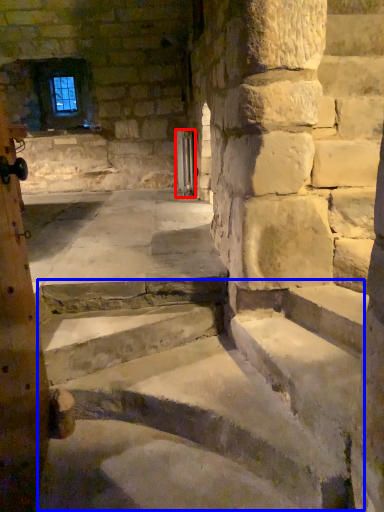
Question: Which of the following is the farthest to the observer, door (highlighted by a red box) or stairwell (highlighted by a blue box)?

Choices:
 (A) door
 (B) stairwell

Answer: (A)